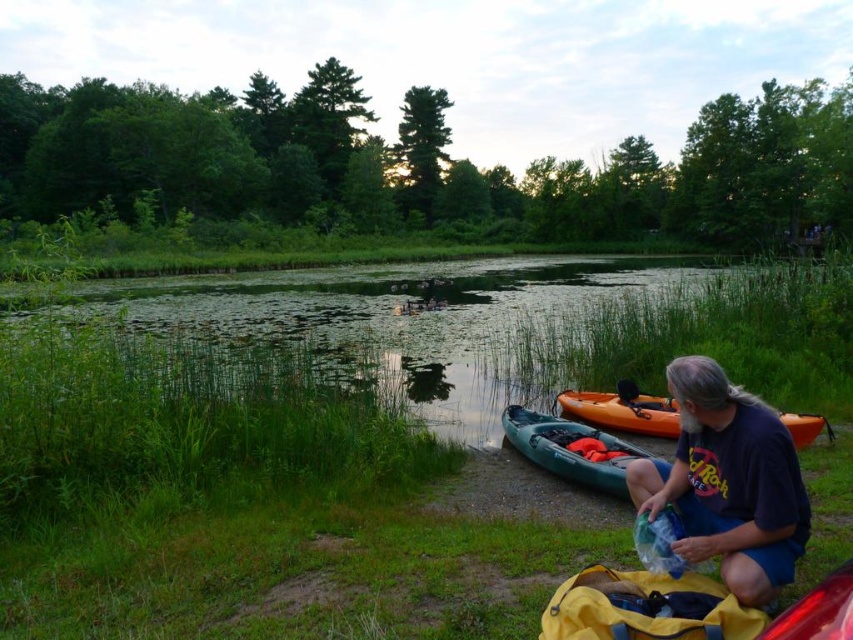
Question: Which of the following is the farthest from the observer?

Choices:
 (A) (577, 412)
 (B) (521, 413)
 (C) (712, 369)

Answer: (A)

Question: Which object is the closest to the green grassy water at center?

Choices:
 (A) teal plastic canoe at lower center
 (B) orange plastic canoe at lower right

Answer: (A)

Question: Is teal plastic canoe at lower center to the left of orange plastic canoe at lower right from the viewer's perspective?

Choices:
 (A) yes
 (B) no

Answer: (A)

Question: In this image, where is dark blue t-shirt at lower right located relative to teal plastic canoe at lower center?

Choices:
 (A) left
 (B) right

Answer: (A)

Question: Can you confirm if green grassy water at center is positioned to the left of teal plastic canoe at lower center?

Choices:
 (A) no
 (B) yes

Answer: (B)

Question: Estimate the real-world distances between objects in this image. Which object is farther from the green grassy water at center?

Choices:
 (A) teal plastic canoe at lower center
 (B) dark blue t-shirt at lower right
 (C) orange plastic canoe at lower right

Answer: (B)